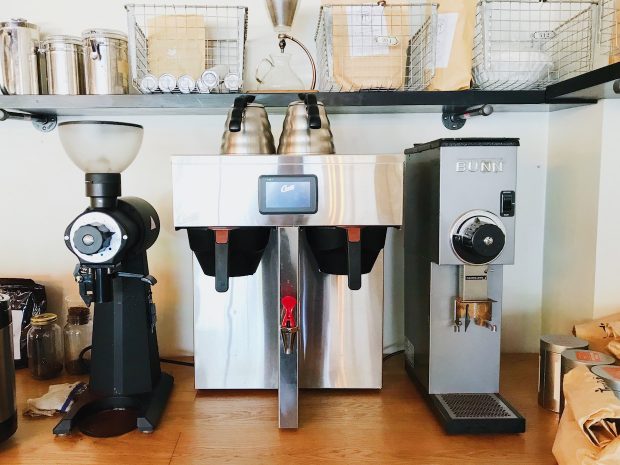
Find the location of `industrial coffee maker`. industrial coffee maker is located at coordinates (342, 193).